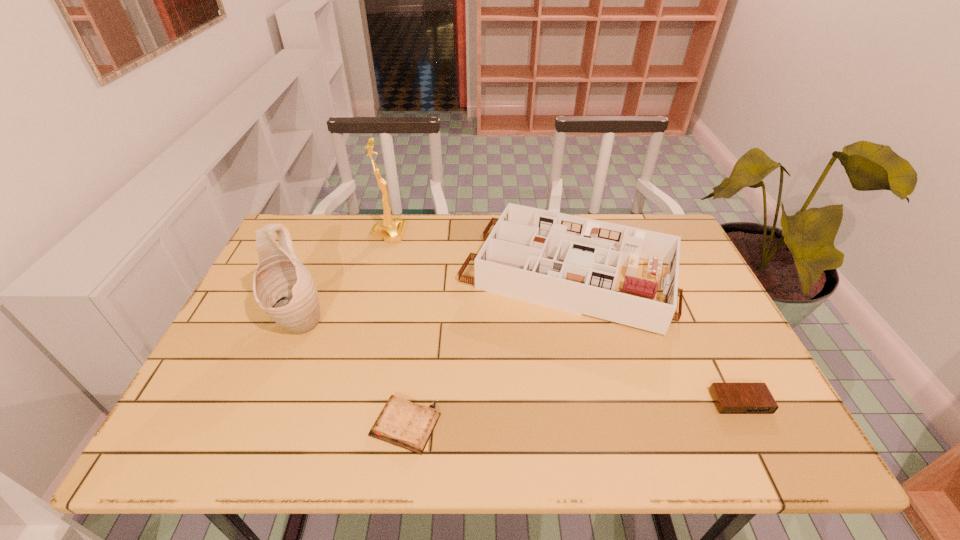
The width and height of the screenshot is (960, 540). I want to click on unoccupied area between the dollhouse and the fourth object from right to left, so click(x=478, y=254).

This screenshot has width=960, height=540. Identify the location of vacant area between the alarm clock and the award. (564, 318).

At what (x,y) coordinates should I click in order to perform the action: click on vacant point located between the third shortest object and the second shortest object. Please return your answer as a coordinate pair (x, y). The image size is (960, 540). Looking at the image, I should click on (654, 338).

Identify which object is the fourth closest to the dollhouse. Please provide its 2D coordinates. Your answer should be formatted as a tuple, i.e. [(x, y)], where the tuple contains the x and y coordinates of a point satisfying the conditions above.

[(283, 287)]

In order to click on object that is the second closest to the alarm clock in this screenshot , I will do `click(402, 423)`.

Identify the location of free space that satisfies the following two spatial constraints: 1. at the spout of the shortest object; 2. on the left side of the pitcher. This screenshot has width=960, height=540. (257, 425).

Identify the location of free space that satisfies the following two spatial constraints: 1. on the front-facing side of the award; 2. on the right side of the third shortest object. (378, 274).

This screenshot has height=540, width=960. I want to click on vacant region that satisfies the following two spatial constraints: 1. at the spout of the diary; 2. on the left side of the pitcher, so click(x=257, y=425).

Locate an element on the screen. free space that satisfies the following two spatial constraints: 1. on the front-facing side of the second object from left to right; 2. at the spout of the pitcher is located at coordinates (367, 321).

Where is `free location that satisfies the following two spatial constraints: 1. at the spout of the diary; 2. on the left side of the leftmost object`? The height and width of the screenshot is (540, 960). free location that satisfies the following two spatial constraints: 1. at the spout of the diary; 2. on the left side of the leftmost object is located at coordinates (257, 425).